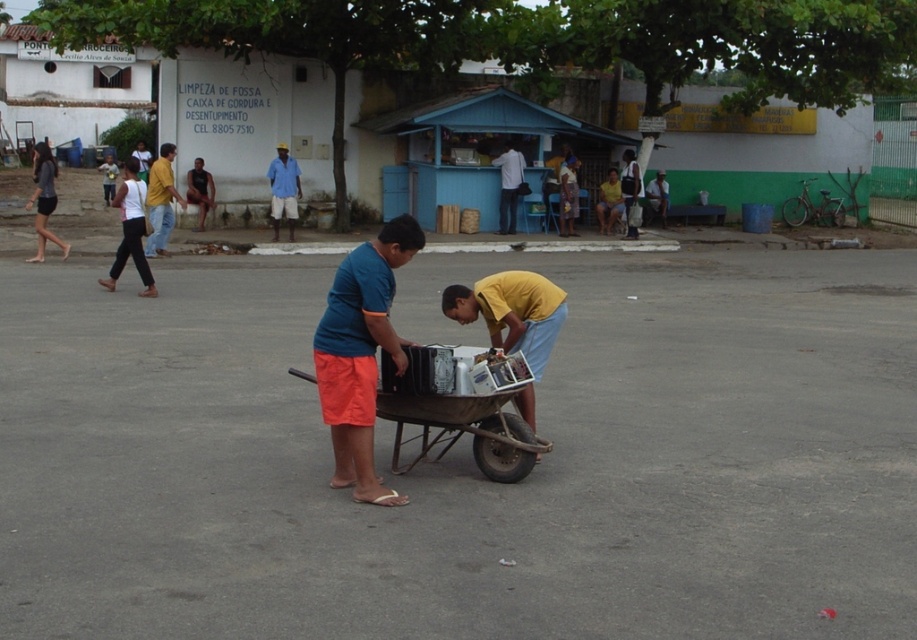
Between point (446, 406) and point (35, 172), which one is positioned behind?

Positioned behind is point (35, 172).

Who is more forward, (x=449, y=417) or (x=54, y=204)?

Point (x=449, y=417)

Which is in front, point (498, 422) or point (39, 208)?

Point (498, 422) is in front.

Locate an element on the screen. This screenshot has height=640, width=917. brown wooden cart at center is located at coordinates (470, 420).

Which is behind, point (373, 374) or point (159, 241)?

The point (159, 241) is behind.

Measure the distance between point (378,284) and camera.

A distance of 7.09 meters exists between point (378,284) and camera.

This screenshot has height=640, width=917. Describe the element at coordinates (360, 353) in the screenshot. I see `blue matte shirt at center` at that location.

You are a GUI agent. You are given a task and a screenshot of the screen. Output one action in this format:
    pyautogui.click(x=<x>, y=<y>)
    Task: Click on the blue matte shirt at center
    Image resolution: width=917 pixels, height=640 pixels.
    Given the screenshot: What is the action you would take?
    pyautogui.click(x=360, y=353)

Which is above, matte black shorts at left or blue cotton shirt at center?

matte black shorts at left

Measure the distance from matte black shorts at left to blue cotton shirt at center.

The distance of matte black shorts at left from blue cotton shirt at center is 4.78 meters.

I want to click on matte black shorts at left, so click(x=43, y=198).

This screenshot has height=640, width=917. I want to click on matte black shorts at left, so [x=43, y=198].